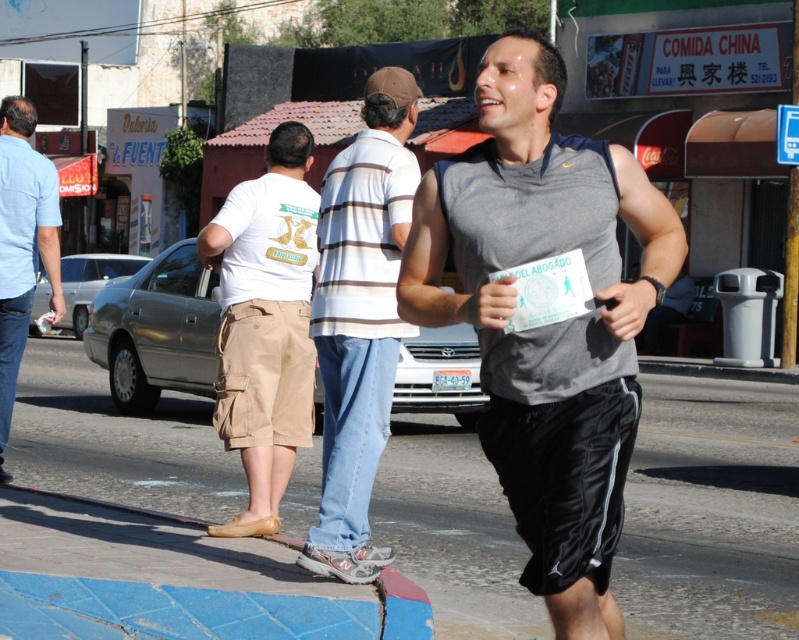
Looking at this image, you are a photographer trying to capture both the gray fabric tank top at center and the striped cotton shirt at center in a single shot. Based on their positions, which one would require you to zoom out more to include both in the frame?

The gray fabric tank top at center might be wider than striped cotton shirt at center, so you would need to zoom out more to include both in the frame.

You are standing at the point with coordinates point (279,259) and want to walk to the point with coordinates point (380,552). Which direction should you move in to get closer to your destination?

To move from point (279,259) to point (380,552), you should move forward since point (380,552) is closer to the viewer than point (279,259).